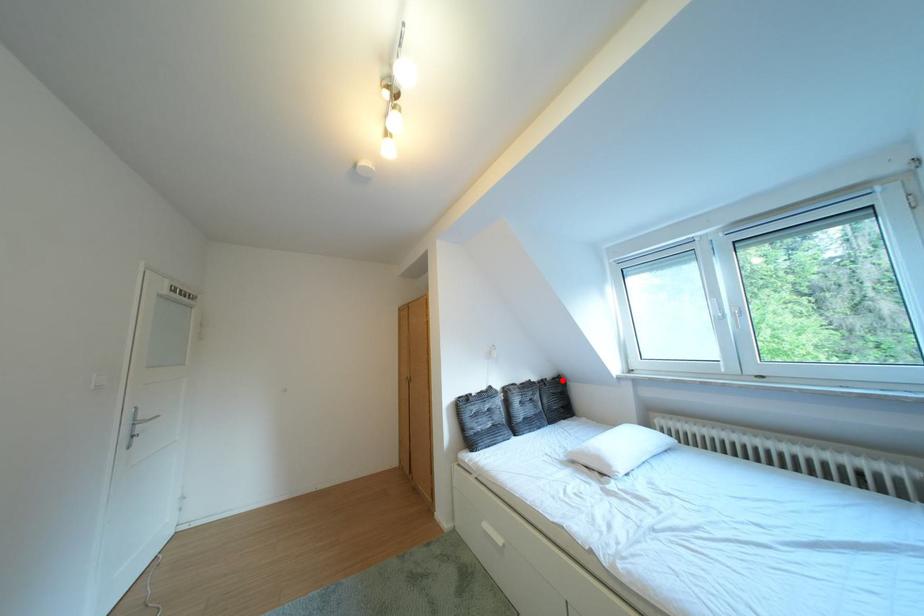
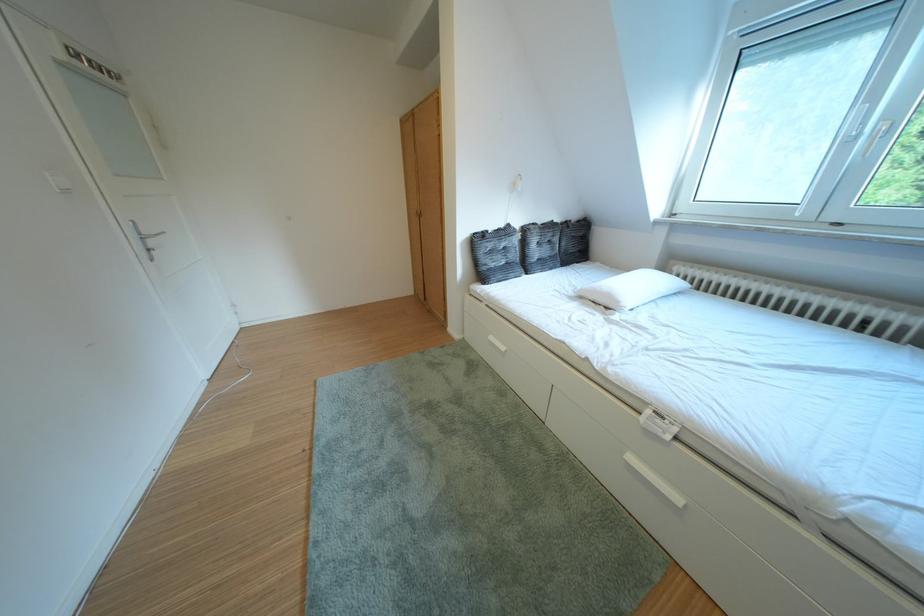
Question: I am providing you with two images of the same scene from different viewpoints. Given a red point in image1, look at the same physical point in image2. Is it:

Choices:
 (A) Closer to the viewpoint
 (B) Farther from the viewpoint

Answer: (A)